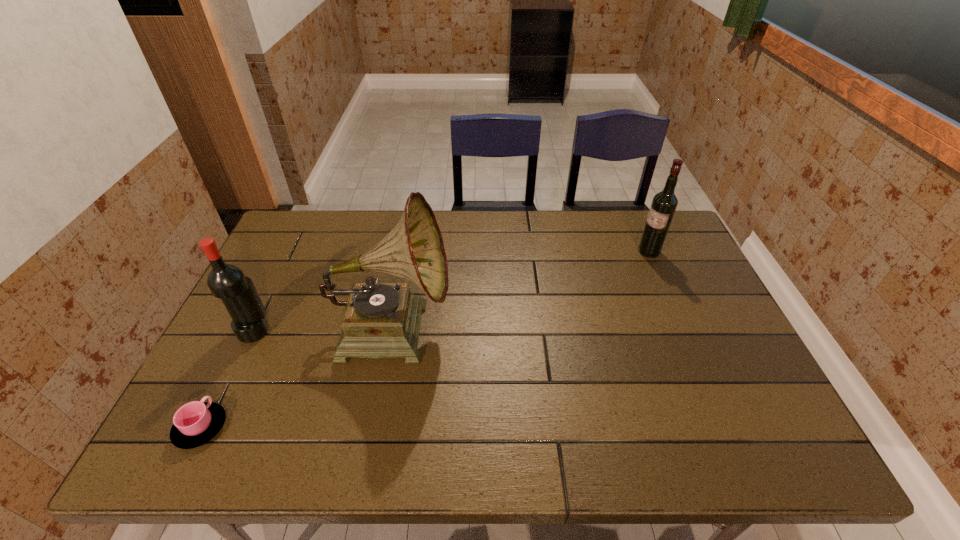
Identify the location of vacant space located on the front and back of the rightmost object. (561, 252).

What are the coordinates of `free space located 0.250m on the back of the left wine bottle` in the screenshot? It's located at (290, 258).

Locate an element on the screen. The width and height of the screenshot is (960, 540). free region located on the side with the handle of the shortest object is located at coordinates (252, 323).

Locate an element on the screen. The image size is (960, 540). free region located 0.260m on the side with the handle of the shortest object is located at coordinates (254, 320).

Find the location of `vacant region located 0.270m on the side with the handle of the shortest object`. vacant region located 0.270m on the side with the handle of the shortest object is located at coordinates (255, 318).

At what (x,y) coordinates should I click in order to perform the action: click on object that is at the far edge. Please return your answer as a coordinate pair (x, y). Looking at the image, I should click on (664, 203).

Image resolution: width=960 pixels, height=540 pixels. I want to click on object that is positioned at the near edge, so click(195, 423).

Find the location of `wine bottle that is at the left edge`. wine bottle that is at the left edge is located at coordinates (225, 281).

Identify the location of cup at the left edge. (195, 423).

Image resolution: width=960 pixels, height=540 pixels. Find the location of `object at the right edge`. object at the right edge is located at coordinates (664, 203).